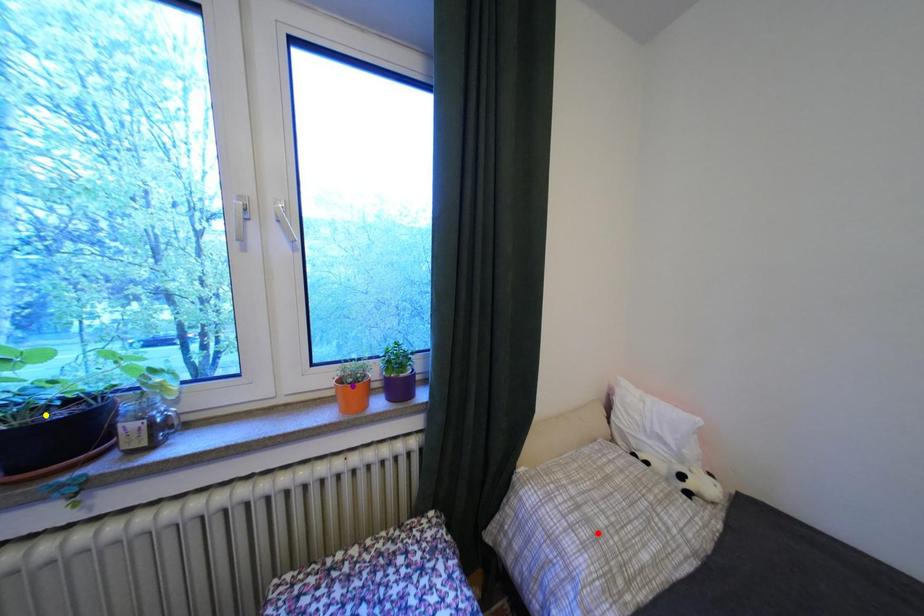
Order these from farthest to nearest:
yellow point | purple point | red point

purple point
red point
yellow point